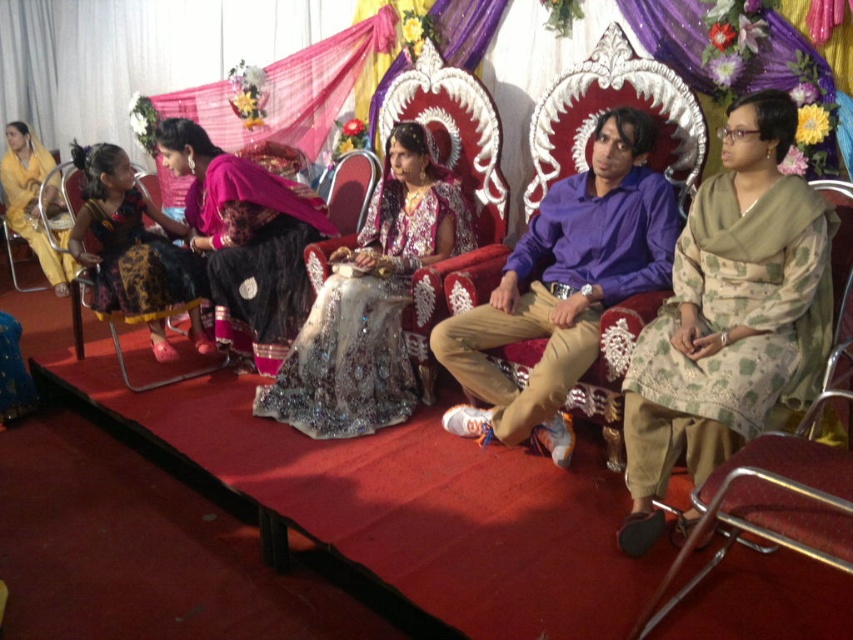
Who is positioned more to the left, sparkling silver dress at center or matte yellow dress at left?

matte yellow dress at left

Is sparkling silver dress at center closer to the viewer compared to matte yellow dress at left?

Yes, sparkling silver dress at center is closer to the viewer.

Describe the element at coordinates (370, 301) in the screenshot. Image resolution: width=853 pixels, height=640 pixels. I see `sparkling silver dress at center` at that location.

This screenshot has height=640, width=853. What are the coordinates of `sparkling silver dress at center` in the screenshot? It's located at (370, 301).

Who is shorter, sparkling silver dress at center or shiny pink fabric at left?

Standing shorter between the two is shiny pink fabric at left.

From the picture: Is sparkling silver dress at center above shiny pink fabric at left?

Incorrect, sparkling silver dress at center is not positioned above shiny pink fabric at left.

I want to click on sparkling silver dress at center, so click(x=370, y=301).

Does purple cotton shirt at center appear on the right side of sparkling silver dress at center?

Correct, you'll find purple cotton shirt at center to the right of sparkling silver dress at center.

Between purple cotton shirt at center and sparkling silver dress at center, which one appears on the right side from the viewer's perspective?

purple cotton shirt at center is more to the right.

The image size is (853, 640). I want to click on purple cotton shirt at center, so click(x=563, y=288).